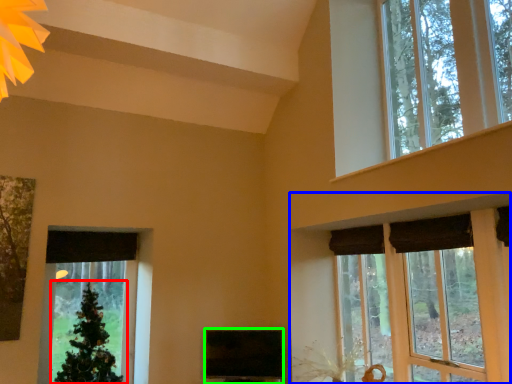
Question: Which object is positioned farthest from christmas tree (highlighted by a red box)? Select from window (highlighted by a blue box) and window screen (highlighted by a green box).

Choices:
 (A) window
 (B) window screen

Answer: (A)